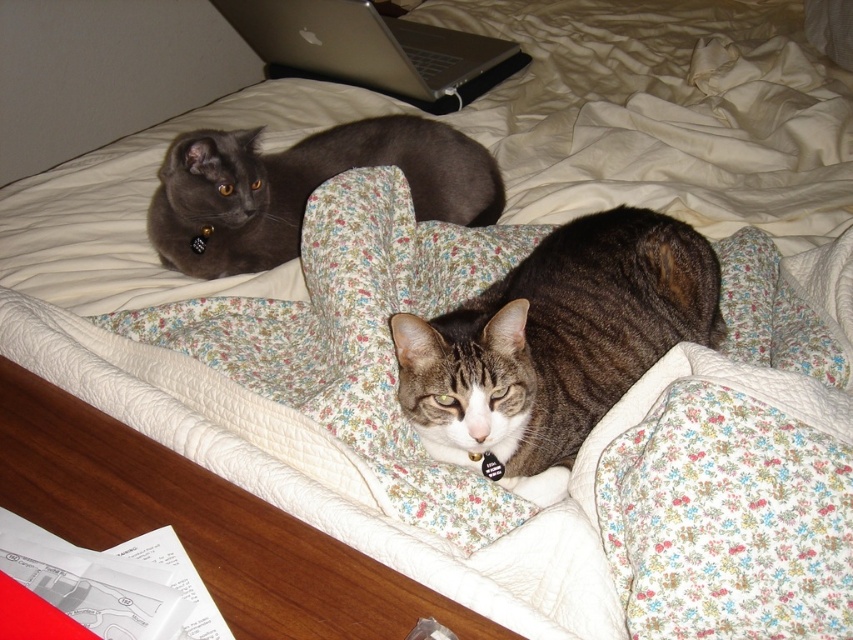
Image resolution: width=853 pixels, height=640 pixels. What do you see at coordinates (556, 339) in the screenshot?
I see `tabby fur cat at center` at bounding box center [556, 339].

Does tabby fur cat at center appear under silver metallic laptop at upper center?

Yes, tabby fur cat at center is below silver metallic laptop at upper center.

Locate an element on the screen. tabby fur cat at center is located at coordinates (556, 339).

Can you confirm if tabby fur cat at center is wider than matte gray cat at upper left?

Incorrect, tabby fur cat at center's width does not surpass matte gray cat at upper left's.

Is tabby fur cat at center positioned at the back of matte gray cat at upper left?

No, it is not.

Between point (527, 268) and point (227, 225), which one is positioned behind?

The point (227, 225) is behind.

Locate an element on the screen. tabby fur cat at center is located at coordinates (556, 339).

Based on the photo, is matte gray cat at upper left bigger than silver metallic laptop at upper center?

Incorrect, matte gray cat at upper left is not larger than silver metallic laptop at upper center.

In the scene shown: Who is positioned more to the right, matte gray cat at upper left or silver metallic laptop at upper center?

matte gray cat at upper left is more to the right.

What are the coordinates of `matte gray cat at upper left` in the screenshot? It's located at (303, 188).

At what (x,y) coordinates should I click in order to perform the action: click on matte gray cat at upper left. Please return your answer as a coordinate pair (x, y). The width and height of the screenshot is (853, 640). Looking at the image, I should click on (303, 188).